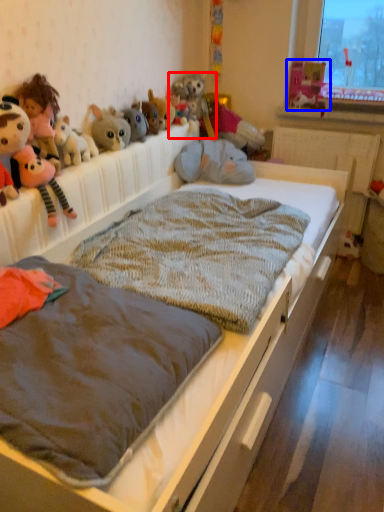
Question: Which of the following is the farthest to the observer, toy (highlighted by a red box) or toy (highlighted by a blue box)?

Choices:
 (A) toy
 (B) toy

Answer: (B)